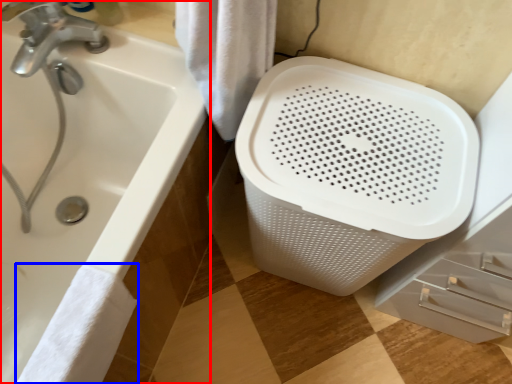
Question: Which object is closer to the camera taking this photo, bathtub (highlighted by a red box) or bath towel (highlighted by a blue box)?

Choices:
 (A) bathtub
 (B) bath towel

Answer: (B)